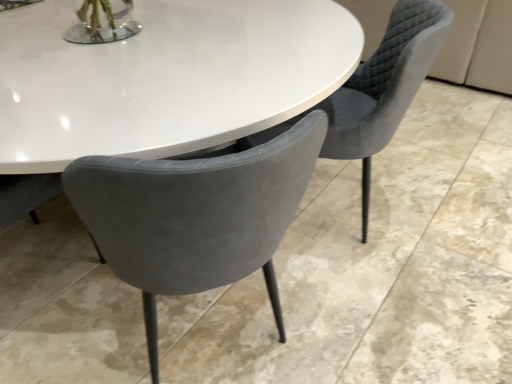
Question: Could matte gray chair at center, the 1th chair from the left, be considered to be inside velvet grey chair at center, arranged as the 2th chair when viewed from the left?

Choices:
 (A) yes
 (B) no

Answer: (B)

Question: Is velvet grey chair at center, which ranks as the first chair in right-to-left order, smaller than matte gray chair at center, the 1th chair from the left?

Choices:
 (A) yes
 (B) no

Answer: (B)

Question: Considering the relative sizes of velvet grey chair at center, arranged as the 2th chair when viewed from the left, and matte gray chair at center, the 1th chair from the left, in the image provided, is velvet grey chair at center, arranged as the 2th chair when viewed from the left, bigger than matte gray chair at center, the 1th chair from the left,?

Choices:
 (A) no
 (B) yes

Answer: (B)

Question: Can you confirm if velvet grey chair at center, arranged as the 2th chair when viewed from the left, is positioned to the right of matte gray chair at center, which is the second chair from right to left?

Choices:
 (A) yes
 (B) no

Answer: (A)

Question: Is velvet grey chair at center, which ranks as the first chair in right-to-left order, located outside matte gray chair at center, which is the second chair from right to left?

Choices:
 (A) no
 (B) yes

Answer: (B)

Question: From the image's perspective, would you say velvet grey chair at center, arranged as the 2th chair when viewed from the left, is shown under matte gray chair at center, which is the second chair from right to left?

Choices:
 (A) yes
 (B) no

Answer: (B)

Question: Is matte gray chair at center, which is the second chair from right to left, positioned before velvet grey chair at center, arranged as the 2th chair when viewed from the left?

Choices:
 (A) no
 (B) yes

Answer: (B)

Question: Is matte gray chair at center, which is the second chair from right to left, aimed at velvet grey chair at center, which ranks as the first chair in right-to-left order?

Choices:
 (A) yes
 (B) no

Answer: (B)

Question: From a real-world perspective, is matte gray chair at center, the 1th chair from the left, on velvet grey chair at center, arranged as the 2th chair when viewed from the left?

Choices:
 (A) yes
 (B) no

Answer: (A)

Question: Can you confirm if matte gray chair at center, the 1th chair from the left, is wider than velvet grey chair at center, which ranks as the first chair in right-to-left order?

Choices:
 (A) yes
 (B) no

Answer: (B)

Question: From a real-world perspective, is matte gray chair at center, which is the second chair from right to left, physically below velvet grey chair at center, which ranks as the first chair in right-to-left order?

Choices:
 (A) yes
 (B) no

Answer: (B)

Question: Considering the relative positions of matte gray chair at center, which is the second chair from right to left, and velvet grey chair at center, which ranks as the first chair in right-to-left order, in the image provided, is matte gray chair at center, which is the second chair from right to left, to the left of velvet grey chair at center, which ranks as the first chair in right-to-left order, from the viewer's perspective?

Choices:
 (A) no
 (B) yes

Answer: (B)

Question: From the image's perspective, is matte gray chair at center, the 1th chair from the left, positioned above or below velvet grey chair at center, arranged as the 2th chair when viewed from the left?

Choices:
 (A) below
 (B) above

Answer: (A)